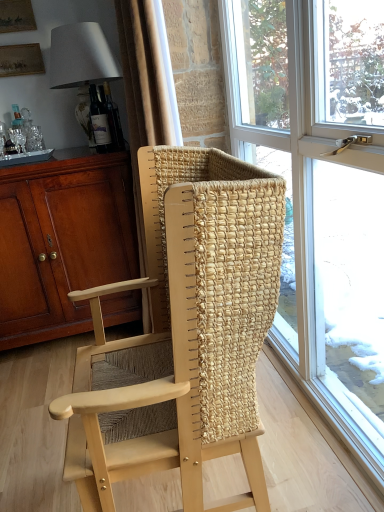
Question: Looking at their shapes, would you say natural woven wood chair at center is wider or thinner than matte brown cabinet at left?

Choices:
 (A) wide
 (B) thin

Answer: (B)

Question: From their relative heights in the image, would you say natural woven wood chair at center is taller or shorter than matte brown cabinet at left?

Choices:
 (A) tall
 (B) short

Answer: (A)

Question: Which object is the closest to the matte gray lampshade at upper left?

Choices:
 (A) natural woven wood chair at center
 (B) matte brown cabinet at left
 (C) beige fabric curtain at upper center
 (D) clear glass window at center

Answer: (C)

Question: Which of these objects is positioned closest to the clear glass window at center?

Choices:
 (A) matte gray lampshade at upper left
 (B) beige fabric curtain at upper center
 (C) matte brown cabinet at left
 (D) natural woven wood chair at center

Answer: (D)